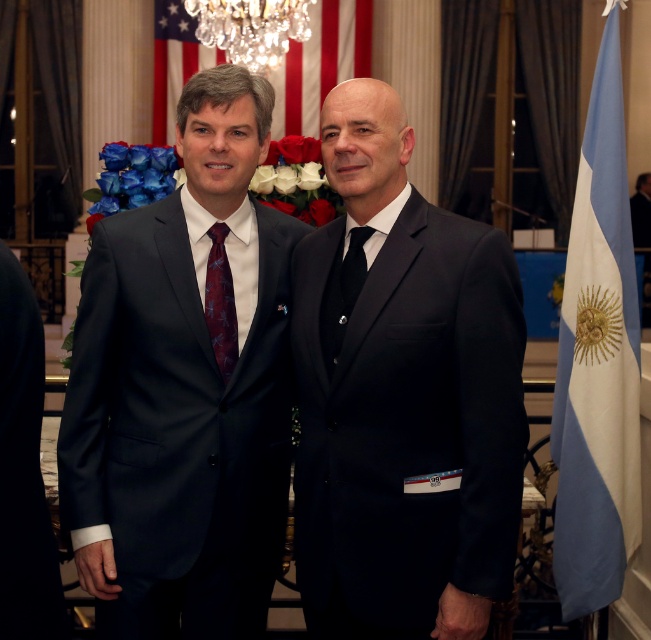
Question: Estimate the real-world distances between objects in this image. Which object is farther from the crystal glass chandelier at upper center?

Choices:
 (A) black matte suit at center
 (B) dark blue suit at center
 (C) american flag at upper center
 (D) matte black suit at center

Answer: (A)

Question: Is the position of matte black suit at center more distant than that of american flag at upper center?

Choices:
 (A) no
 (B) yes

Answer: (A)

Question: Observing the image, what is the correct spatial positioning of matte black suit at center in reference to black silk tie at center?

Choices:
 (A) right
 (B) left

Answer: (B)

Question: Considering the relative positions of blue fabric flag at right and dark blue fabric suit at center in the image provided, where is blue fabric flag at right located with respect to dark blue fabric suit at center?

Choices:
 (A) below
 (B) above

Answer: (B)

Question: Which of these objects is positioned farthest from the blue fabric flag at right?

Choices:
 (A) dark red silk tie at center
 (B) crystal glass chandelier at upper center
 (C) dark blue suit at center
 (D) black matte suit at center

Answer: (C)

Question: Based on their relative distances, which object is nearer to the blue fabric flag at right?

Choices:
 (A) crystal glass chandelier at upper center
 (B) matte black suit at center

Answer: (B)